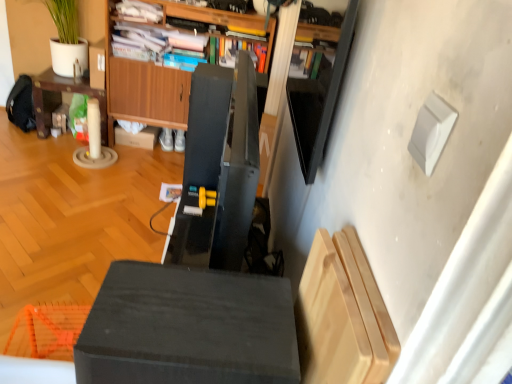
I want to click on vacant area that is in front of matte brown table at left, so click(45, 157).